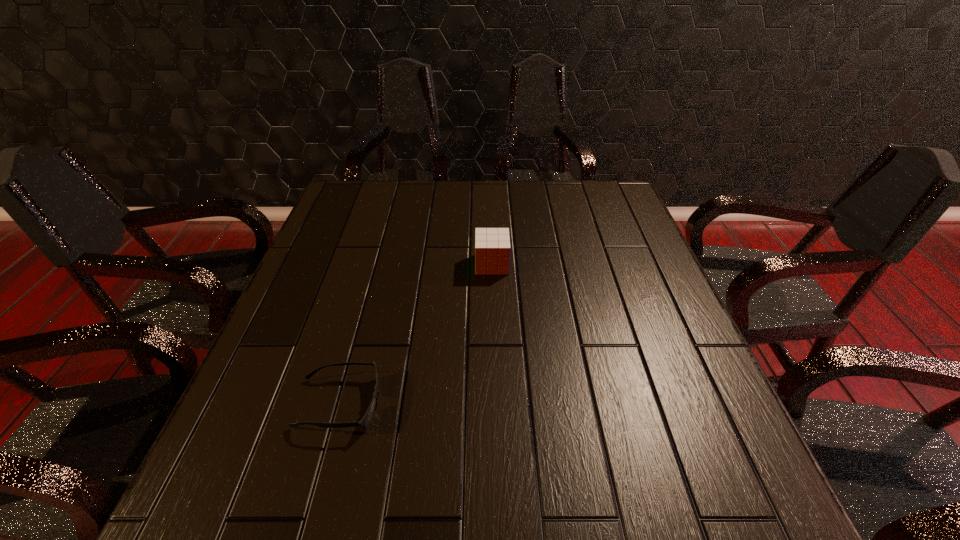
This screenshot has height=540, width=960. In order to click on the right object in this screenshot , I will do `click(492, 245)`.

Identify the location of cube. (492, 245).

Where is `the nearer object`? This screenshot has height=540, width=960. the nearer object is located at coordinates (368, 417).

Identify the location of sunglasses. tap(368, 417).

The width and height of the screenshot is (960, 540). I want to click on vacant space situated 0.320m on the right of the right object, so click(x=629, y=264).

I want to click on blank space located on the front-facing side of the sunglasses, so click(489, 403).

This screenshot has height=540, width=960. Identify the location of object situated at the left edge. (368, 417).

In order to click on free point at the far edge in this screenshot , I will do `click(402, 218)`.

The height and width of the screenshot is (540, 960). I want to click on vacant space at the near edge of the desktop, so click(657, 490).

Locate an element on the screen. This screenshot has width=960, height=540. vacant region at the left edge of the desktop is located at coordinates (319, 303).